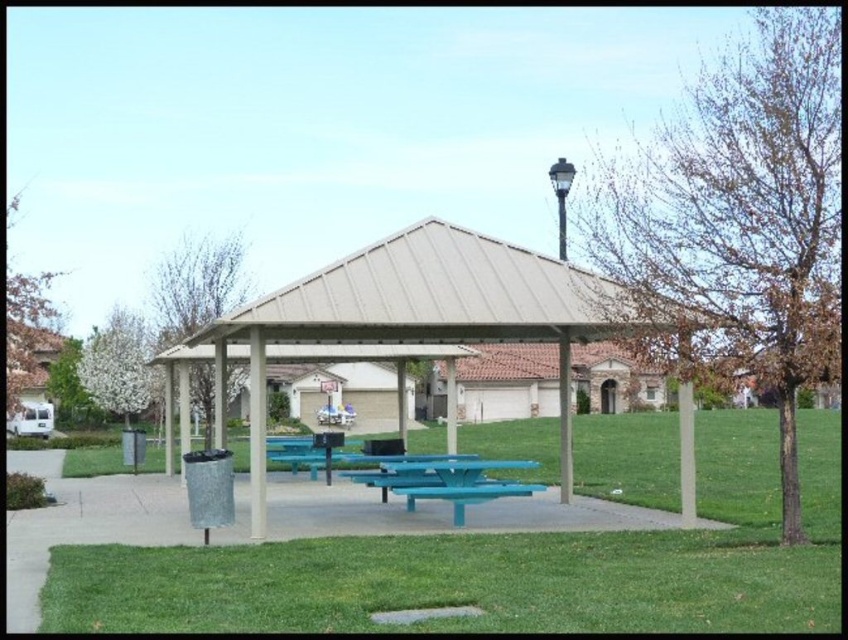
You are a gardener who needs to mow the lawn. You observe the green grass at center and the green grass at lower center. Which area requires immediate attention due to its height?

The green grass at center requires immediate attention because it has a greater height compared to the green grass at lower center.